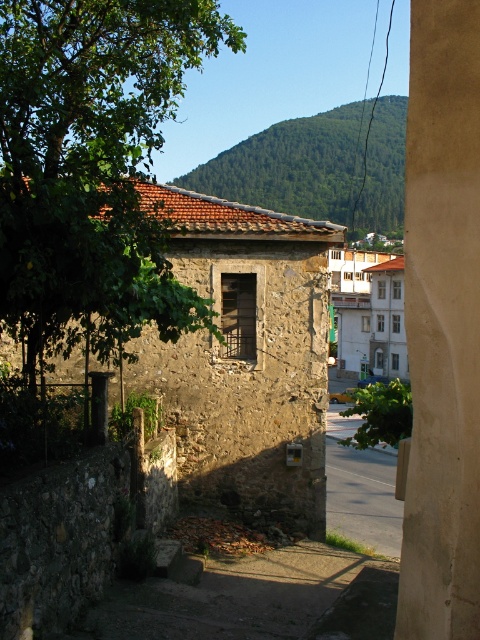
Question: Can you confirm if green forested hill at upper center is bigger than asphalt road at lower center?

Choices:
 (A) no
 (B) yes

Answer: (B)

Question: Is green leafy tree at upper left wider than asphalt road at lower center?

Choices:
 (A) no
 (B) yes

Answer: (B)

Question: Can you confirm if green leafy tree at upper left is positioned to the right of green forested hill at upper center?

Choices:
 (A) yes
 (B) no

Answer: (B)

Question: Based on their relative distances, which object is nearer to the green leafy tree at upper left?

Choices:
 (A) green forested hill at upper center
 (B) asphalt road at lower center

Answer: (B)

Question: Which object is positioned closest to the asphalt road at lower center?

Choices:
 (A) green leafy tree at upper left
 (B) green forested hill at upper center

Answer: (A)

Question: Which point is closer to the camera?

Choices:
 (A) (274, 154)
 (B) (52, 180)
 (C) (359, 512)

Answer: (B)